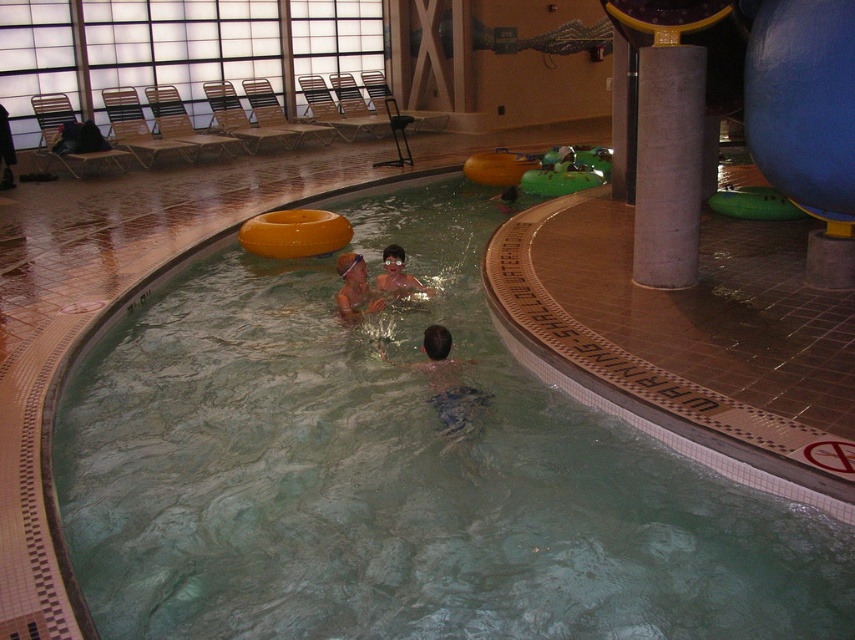
Can you confirm if green rubber at center is thinner than matte skin at center?

In fact, green rubber at center might be wider than matte skin at center.

What do you see at coordinates (397, 474) in the screenshot? This screenshot has height=640, width=855. I see `green rubber at center` at bounding box center [397, 474].

Locate an element on the screen. green rubber at center is located at coordinates (397, 474).

Is matte skin at center shorter than matte orange swim ring at upper center?

No, matte skin at center is not shorter than matte orange swim ring at upper center.

How distant is matte skin at center from matte orange swim ring at upper center?

matte skin at center and matte orange swim ring at upper center are 12.01 inches apart from each other.

Measure the distance between matte skin at center and camera.

They are 5.99 meters apart.

Where is `matte skin at center`? matte skin at center is located at coordinates (354, 289).

In the scene shown: Does green rubber at center appear over matte orange swim ring at upper center?

No, green rubber at center is not above matte orange swim ring at upper center.

Is green rubber at center below matte orange swim ring at upper center?

Indeed, green rubber at center is positioned under matte orange swim ring at upper center.

Is point (181, 522) closer to camera compared to point (399, 257)?

That is True.

What are the coordinates of `green rubber at center` in the screenshot? It's located at (x=397, y=474).